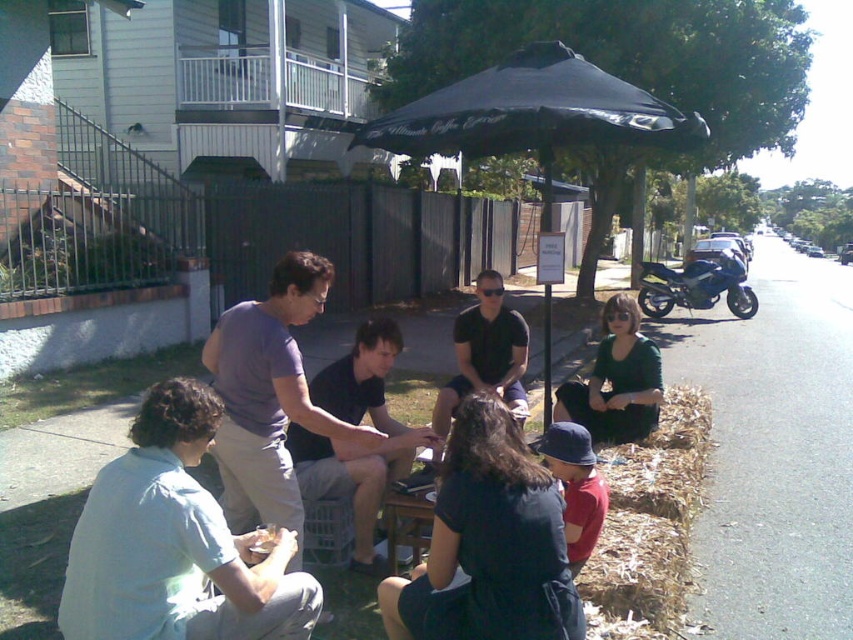
Question: Which of the following is the closest to the observer?

Choices:
 (A) (299, 458)
 (B) (590, 529)

Answer: (B)

Question: Is light blue shirt at lower left below black matte shirt at center?

Choices:
 (A) yes
 (B) no

Answer: (A)

Question: Is dark blue fabric at center in front of black matte shirt at center?

Choices:
 (A) yes
 (B) no

Answer: (A)

Question: Which point is closer to the camera?

Choices:
 (A) (630, 332)
 (B) (444, 474)
 (C) (599, 92)

Answer: (B)

Question: Which point appears closest to the camera in this image?

Choices:
 (A) click(698, 280)
 (B) click(361, 429)

Answer: (B)

Question: Is black cotton shirt at center to the left of red cotton shirt at lower center from the viewer's perspective?

Choices:
 (A) yes
 (B) no

Answer: (A)